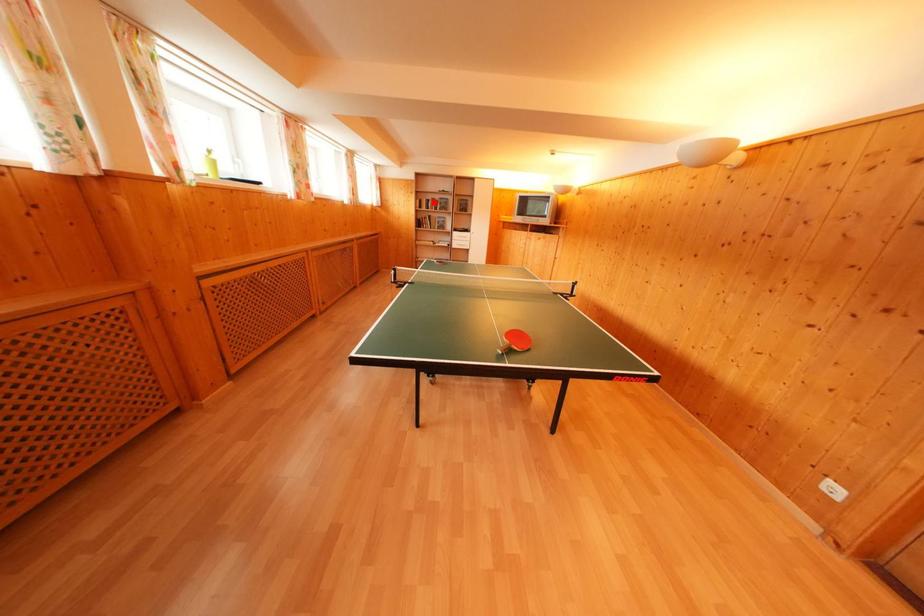
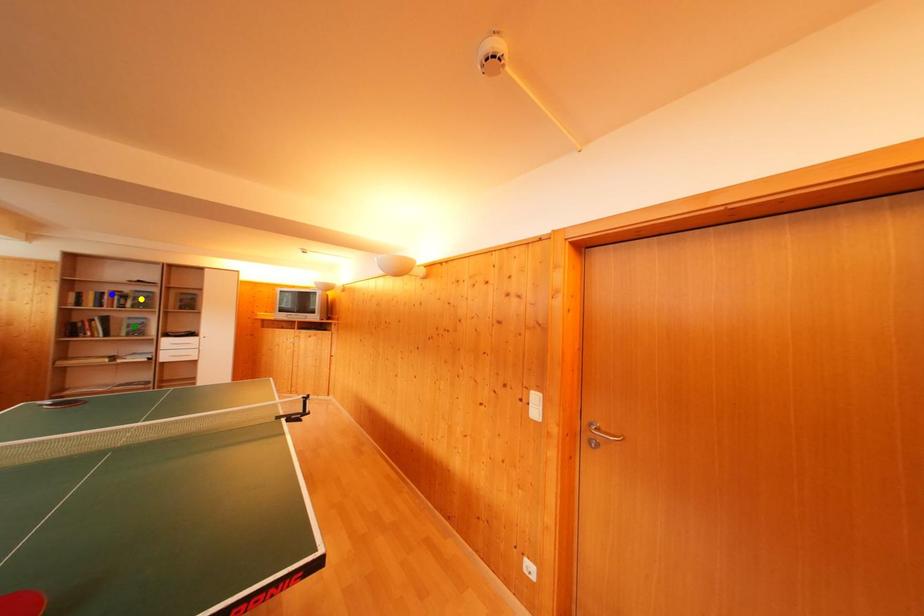
Question: I am providing you with two images of the same scene from different viewpoints. A red point is marked on the first image. You are given multiple points on the second image. In image 2, which mark is for the same physical point as the one in image 1?

Choices:
 (A) green point
 (B) blue point
 (C) yellow point

Answer: (B)